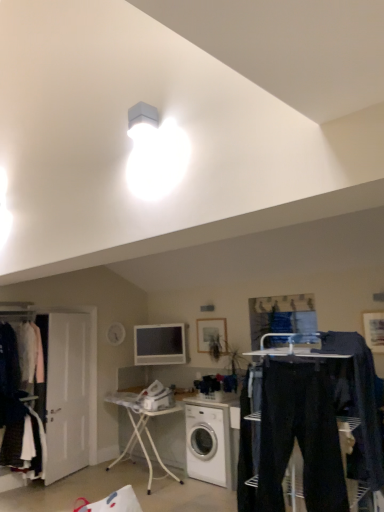
Image resolution: width=384 pixels, height=512 pixels. What do you see at coordinates (374, 330) in the screenshot?
I see `wooden framed picture at right, the 1th picture frame when ordered from right to left` at bounding box center [374, 330].

Image resolution: width=384 pixels, height=512 pixels. What are the coordinates of `wooden framed picture at right, the second picture frame when ordered from left to right` in the screenshot? It's located at (374, 330).

Describe the element at coordinates (142, 121) in the screenshot. I see `matte gray lampshade at upper center` at that location.

The height and width of the screenshot is (512, 384). What do you see at coordinates (71, 384) in the screenshot? I see `white matte door at left, positioned as the 2th closet in front-to-back order` at bounding box center [71, 384].

The image size is (384, 512). What do you see at coordinates (361, 396) in the screenshot?
I see `dark blue jeans at center` at bounding box center [361, 396].

In order to face white metal ironing board at center, should I rotate leftwards or rightwards?

To face it directly, rotate left by 7.445 degrees.

Where is `wooden framed picture at right, the second picture frame viewed from the back`? The width and height of the screenshot is (384, 512). wooden framed picture at right, the second picture frame viewed from the back is located at coordinates (374, 330).

Is dark blue jeans at center placed right next to white glossy television at center?

No, dark blue jeans at center is not in contact with white glossy television at center.

Considering the sizes of objects dark blue jeans at center and white glossy television at center in the image provided, who is bigger, dark blue jeans at center or white glossy television at center?

With larger size is dark blue jeans at center.

Is dark blue jeans at center positioned beyond the bounds of white glossy television at center?

Yes, dark blue jeans at center is outside of white glossy television at center.

Is dark blue jeans at center shorter than white glossy television at center?

No.

Is point (318, 350) behind point (59, 426)?

No.

Is dark blue jeans at center to the left of white matte door at left, the first closet positioned from the back, from the viewer's perspective?

Incorrect, dark blue jeans at center is not on the left side of white matte door at left, the first closet positioned from the back.

Which is in front, dark blue jeans at center or white matte door at left, positioned as the 2th closet in front-to-back order?

dark blue jeans at center is more forward.

Is dark blue jeans at center thinner than white matte door at left, positioned as the 2th closet in front-to-back order?

Incorrect, the width of dark blue jeans at center is not less than that of white matte door at left, positioned as the 2th closet in front-to-back order.

Is the surface of white glossy washing machine at center in direct contact with dark blue jeans at center?

They are not placed beside each other.

Is white glossy washing machine at center aimed at dark blue jeans at center?

No, white glossy washing machine at center is not oriented towards dark blue jeans at center.

Between white glossy washing machine at center and dark blue jeans at center, which one has larger size?

white glossy washing machine at center is bigger.

Which is more to the right, white glossy washing machine at center or dark blue jeans at center?

dark blue jeans at center.

Is white glossy washing machine at center oriented away from white metal ironing board at center?

white glossy washing machine at center does not have its back to white metal ironing board at center.

Is white glossy washing machine at center to the left of white metal ironing board at center from the viewer's perspective?

No, white glossy washing machine at center is not to the left of white metal ironing board at center.

From a real-world perspective, which is physically below, white glossy washing machine at center or white metal ironing board at center?

white glossy washing machine at center is physically lower.

Choose the correct answer: Is white glossy washing machine at center inside white metal ironing board at center or outside it?

The correct answer is: outside.

Considering the relative positions of white glossy washing machine at center and dark blue jeans at center in the image provided, is white glossy washing machine at center to the right of dark blue jeans at center from the viewer's perspective?

No.

Between white glossy washing machine at center and dark blue jeans at center, which one has smaller size?

dark blue jeans at center is smaller.

Which of these two, white glossy washing machine at center or dark blue jeans at center, is thinner?

With smaller width is dark blue jeans at center.

From their relative heights in the image, would you say white glossy washing machine at center is taller or shorter than dark blue jeans at center?

In the image, white glossy washing machine at center appears to be shorter than dark blue jeans at center.

Can you confirm if dark blue jeans at center is shorter than matte black clothes at left, the first closet in the front-to-back sequence?

Indeed, dark blue jeans at center has a lesser height compared to matte black clothes at left, the first closet in the front-to-back sequence.

From the image's perspective, would you say dark blue jeans at center is positioned over matte black clothes at left, the first closet in the front-to-back sequence?

Indeed, from the image's perspective, dark blue jeans at center is shown above matte black clothes at left, the first closet in the front-to-back sequence.

Would you say dark blue jeans at center is outside matte black clothes at left, the first closet in the front-to-back sequence?

That's correct, dark blue jeans at center is outside of matte black clothes at left, the first closet in the front-to-back sequence.

Which is behind, dark blue jeans at center or matte black clothes at left, positioned as the second closet in back-to-front order?

matte black clothes at left, positioned as the second closet in back-to-front order, is further away from the camera.

Who is smaller, matte black clothes at left, the first closet in the front-to-back sequence, or white glossy washing machine at center?

white glossy washing machine at center.

Looking at this image, measure the distance from matte black clothes at left, positioned as the second closet in back-to-front order, to white glossy washing machine at center.

A distance of 5.93 feet exists between matte black clothes at left, positioned as the second closet in back-to-front order, and white glossy washing machine at center.

Is matte black clothes at left, the first closet in the front-to-back sequence, inside the boundaries of white glossy washing machine at center, or outside?

matte black clothes at left, the first closet in the front-to-back sequence, is spatially situated outside white glossy washing machine at center.

From a real-world perspective, between matte black clothes at left, the first closet in the front-to-back sequence, and white glossy washing machine at center, who is vertically higher?

matte black clothes at left, the first closet in the front-to-back sequence.

The height and width of the screenshot is (512, 384). What are the coordinates of `television behind the dark blue jeans at center` in the screenshot? It's located at (159, 344).

Where is `clothing on the right side of white matte door at left, the first closet positioned from the back`? Image resolution: width=384 pixels, height=512 pixels. clothing on the right side of white matte door at left, the first closet positioned from the back is located at coordinates (361, 396).

Based on their spatial positions, is matte wooden picture frame at center, which ranks as the second picture frame in right-to-left order, or white glossy television at center further from matte black clothes at left, positioned as the second closet in back-to-front order?

matte wooden picture frame at center, which ranks as the second picture frame in right-to-left order, is further to matte black clothes at left, positioned as the second closet in back-to-front order.

Based on the photo, based on their spatial positions, is white glossy television at center or wooden framed picture at right, the second picture frame when ordered from left to right, closer to white matte door at left, positioned as the 2th closet in front-to-back order?

white glossy television at center.

Consider the image. Based on their spatial positions, is white matte door at left, positioned as the 2th closet in front-to-back order, or white glossy television at center closer to matte gray lampshade at upper center?

white matte door at left, positioned as the 2th closet in front-to-back order, lies closer to matte gray lampshade at upper center than the other object.

Looking at the image, which one is located closer to white glossy television at center, matte black clothes at left, positioned as the second closet in back-to-front order, or matte gray lampshade at upper center?

matte black clothes at left, positioned as the second closet in back-to-front order.

Looking at the image, which one is located closer to matte black clothes at left, positioned as the second closet in back-to-front order, wooden framed picture at right, the 1th picture frame when ordered from right to left, or white metal ironing board at center?

white metal ironing board at center.

Estimate the real-world distances between objects in this image. Which object is further from white metal ironing board at center, wooden framed picture at right, the second picture frame viewed from the back, or matte wooden picture frame at center, marked as the first picture frame in a back-to-front arrangement?

Among the two, wooden framed picture at right, the second picture frame viewed from the back, is located further to white metal ironing board at center.

From the image, which object appears to be nearer to white matte door at left, positioned as the 2th closet in front-to-back order, white glossy television at center or matte wooden picture frame at center, marked as the first picture frame in a back-to-front arrangement?

The object closer to white matte door at left, positioned as the 2th closet in front-to-back order, is white glossy television at center.

From the picture: Estimate the real-world distances between objects in this image. Which object is closer to dark blue jeans at center, white metal ironing board at center or wooden framed picture at right, the 1th picture frame when ordered from right to left?

wooden framed picture at right, the 1th picture frame when ordered from right to left, is closer to dark blue jeans at center.

You are a GUI agent. You are given a task and a screenshot of the screen. Output one action in this format:
    pyautogui.click(x=<x>, y=<y>)
    Task: Click on the clothing between dark blue jeans at center and wooden framed picture at right, the second picture frame viewed from the back, from front to back
    The image size is (384, 512).
    Given the screenshot: What is the action you would take?
    pyautogui.click(x=361, y=396)

Where is `closet between dark blue jeans at center and white metal ironing board at center from front to back`? closet between dark blue jeans at center and white metal ironing board at center from front to back is located at coordinates (18, 415).

This screenshot has height=512, width=384. I want to click on closet between matte black clothes at left, the first closet in the front-to-back sequence, and white glossy television at center, so click(71, 384).

Find the location of `closet between matte gray lampshade at upper center and white matte door at left, positioned as the 2th closet in front-to-back order, vertically`. closet between matte gray lampshade at upper center and white matte door at left, positioned as the 2th closet in front-to-back order, vertically is located at coordinates (18, 415).